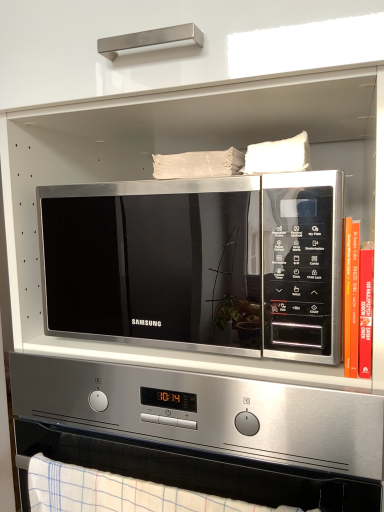
Question: Considering the relative sizes of satin silver microwave at center and white checkered towel at lower center in the image provided, is satin silver microwave at center taller than white checkered towel at lower center?

Choices:
 (A) yes
 (B) no

Answer: (A)

Question: Can you confirm if satin silver microwave at center is positioned to the right of white checkered towel at lower center?

Choices:
 (A) no
 (B) yes

Answer: (B)

Question: Is satin silver microwave at center smaller than white checkered towel at lower center?

Choices:
 (A) yes
 (B) no

Answer: (B)

Question: Does satin silver microwave at center have a greater width compared to white checkered towel at lower center?

Choices:
 (A) no
 (B) yes

Answer: (B)

Question: Is satin silver microwave at center oriented away from white checkered towel at lower center?

Choices:
 (A) yes
 (B) no

Answer: (B)

Question: From a real-world perspective, is satin silver microwave at center physically located above or below satin silver microwave at center?

Choices:
 (A) above
 (B) below

Answer: (A)

Question: From the image's perspective, is satin silver microwave at center located above or below satin silver microwave at center?

Choices:
 (A) above
 (B) below

Answer: (A)

Question: Considering their positions, is satin silver microwave at center located in front of or behind satin silver microwave at center?

Choices:
 (A) front
 (B) behind

Answer: (B)

Question: Is point (314, 353) positioned closer to the camera than point (66, 393)?

Choices:
 (A) closer
 (B) farther

Answer: (A)

Question: From a real-world perspective, is satin silver microwave at center above or below hardcover book at right?

Choices:
 (A) below
 (B) above

Answer: (B)

Question: Is satin silver microwave at center inside or outside of hardcover book at right?

Choices:
 (A) outside
 (B) inside

Answer: (A)

Question: Is point (162, 292) positioned closer to the camera than point (355, 340)?

Choices:
 (A) closer
 (B) farther

Answer: (B)

Question: Is satin silver microwave at center bigger or smaller than hardcover book at right?

Choices:
 (A) small
 (B) big

Answer: (B)

Question: Is satin silver microwave at center taller or shorter than white checkered towel at lower center?

Choices:
 (A) tall
 (B) short

Answer: (A)

Question: From a real-world perspective, is satin silver microwave at center above or below white checkered towel at lower center?

Choices:
 (A) below
 (B) above

Answer: (B)